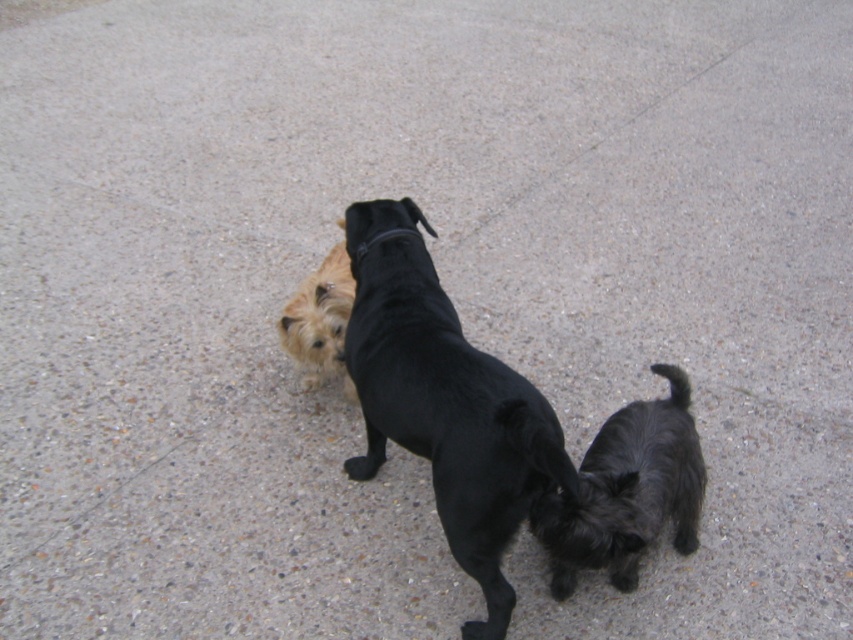
Can you confirm if black smooth dog at center is positioned above black leather neckband at center?

Incorrect, black smooth dog at center is not positioned above black leather neckband at center.

Describe the element at coordinates (445, 404) in the screenshot. I see `black smooth dog at center` at that location.

You are a GUI agent. You are given a task and a screenshot of the screen. Output one action in this format:
    pyautogui.click(x=<x>, y=<y>)
    Task: Click on the black smooth dog at center
    This screenshot has height=640, width=853.
    Given the screenshot: What is the action you would take?
    tap(445, 404)

Is point (456, 381) farther from camera compared to point (643, 509)?

No.

What are the coordinates of `black smooth dog at center` in the screenshot? It's located at (445, 404).

At what (x,y) coordinates should I click in order to perform the action: click on black smooth dog at center. Please return your answer as a coordinate pair (x, y). The image size is (853, 640). Looking at the image, I should click on (445, 404).

Is shaggy black dog at lower right below golden fur dog at center?

Indeed, shaggy black dog at lower right is positioned under golden fur dog at center.

Which is above, shaggy black dog at lower right or golden fur dog at center?

golden fur dog at center

Is point (631, 467) positioned behind point (339, 326)?

No.

At what (x,y) coordinates should I click in order to perform the action: click on shaggy black dog at lower right. Please return your answer as a coordinate pair (x, y). Looking at the image, I should click on (627, 492).